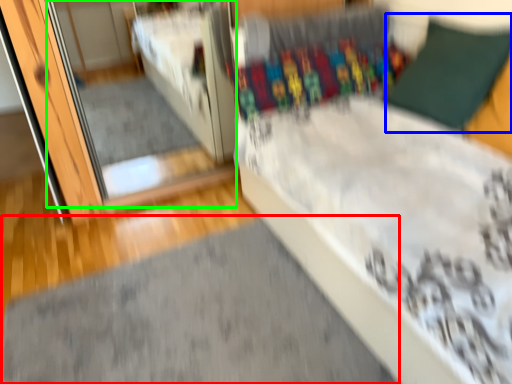
Question: Which is farther away from doormat (highlighted by a red box)? pillow (highlighted by a blue box) or mirror (highlighted by a green box)?

Choices:
 (A) pillow
 (B) mirror

Answer: (B)